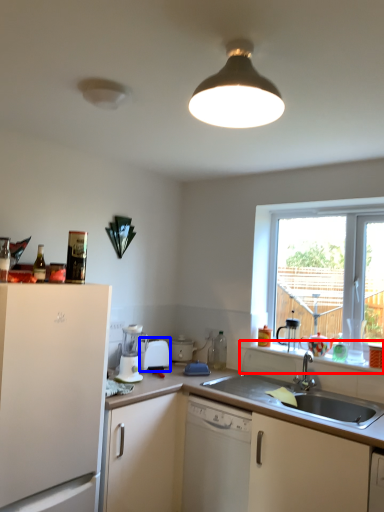
Question: Which point is closer to the camera, window sill (highlighted by a red box) or appliance (highlighted by a blue box)?

Choices:
 (A) window sill
 (B) appliance

Answer: (A)